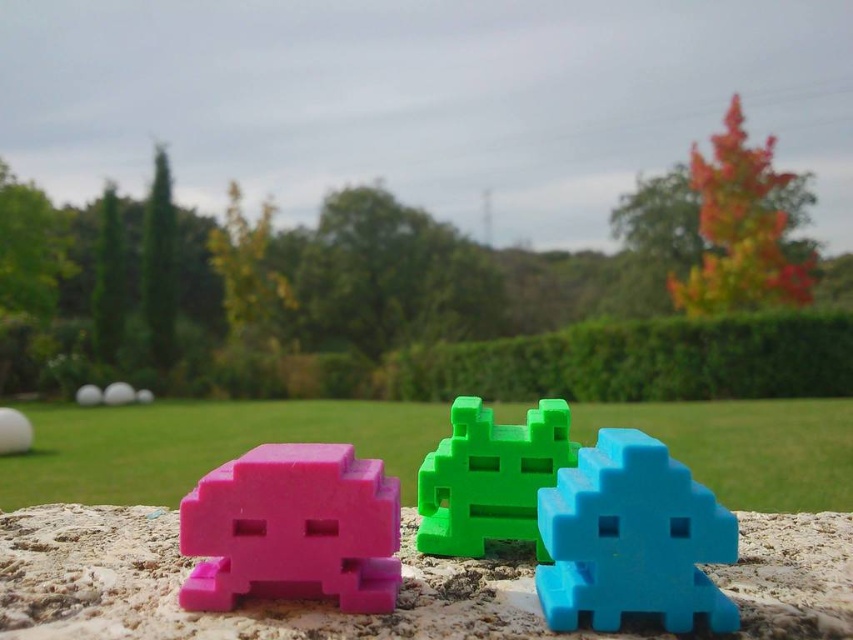
You are a golfer who has just hit a ball from the tee. You see the white matte golf ball at upper left and the matte white sphere at center in the image. Which one is closer to your current position?

The white matte golf ball at upper left is closer to your current position because it is only 3.96 inches away from the matte white sphere at center, which is further away.

You are playing a mini golf game and see the white matte golf ball at upper left and the matte white sphere at center. Which one is positioned more to the left?

The white matte golf ball at upper left is positioned more to the left than the matte white sphere at center.